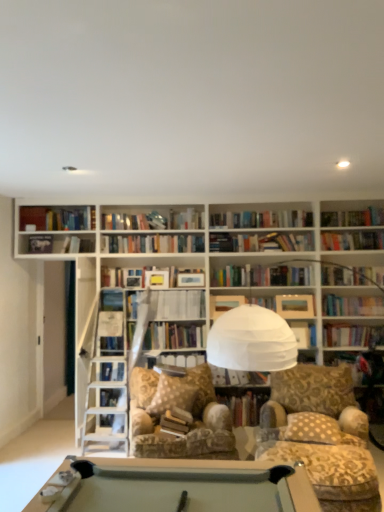
Question: Is hardcover book at upper left, the first paperback book from the left, facing towards patterned fabric chair at center?

Choices:
 (A) no
 (B) yes

Answer: (A)

Question: Is hardcover book at upper left, the first paperback book from the left, in front of patterned fabric chair at center?

Choices:
 (A) no
 (B) yes

Answer: (A)

Question: Is hardcover book at upper left, the first paperback book from the left, shorter than patterned fabric chair at center?

Choices:
 (A) no
 (B) yes

Answer: (B)

Question: Would you consider hardcover book at upper left, the fifth paperback book ordered from the bottom, to be distant from patterned fabric chair at center?

Choices:
 (A) yes
 (B) no

Answer: (A)

Question: From the image's perspective, is hardcover book at upper left, the fifth paperback book ordered from the bottom, below patterned fabric chair at center?

Choices:
 (A) yes
 (B) no

Answer: (B)

Question: Does hardcover book at upper left, positioned as the fifth paperback book in right-to-left order, have a larger size compared to patterned fabric chair at center?

Choices:
 (A) yes
 (B) no

Answer: (B)

Question: Is hardcover book at center, which is the 2th paperback book from right to left, positioned behind hardcover book at center, the 3th book from the left?

Choices:
 (A) yes
 (B) no

Answer: (A)

Question: Does hardcover book at center, arranged as the third paperback book when ordered from the bottom, have a greater height compared to hardcover book at center, which is the 1th book in bottom-to-top order?

Choices:
 (A) yes
 (B) no

Answer: (B)

Question: Can you confirm if hardcover book at center, arranged as the 3th paperback book when viewed from the top, is wider than hardcover book at center, the 3th book from the left?

Choices:
 (A) no
 (B) yes

Answer: (A)

Question: Can you confirm if hardcover book at center, arranged as the third paperback book when ordered from the bottom, is positioned to the right of hardcover book at center, the 3th book from the left?

Choices:
 (A) yes
 (B) no

Answer: (B)

Question: Considering the relative sizes of hardcover book at center, arranged as the third paperback book when ordered from the bottom, and hardcover book at center, which is the 1th book in bottom-to-top order, in the image provided, is hardcover book at center, arranged as the third paperback book when ordered from the bottom, shorter than hardcover book at center, which is the 1th book in bottom-to-top order,?

Choices:
 (A) yes
 (B) no

Answer: (A)

Question: From the image's perspective, would you say hardcover book at upper left, positioned as the fifth paperback book in right-to-left order, is shown under hardcover book at center, which is the 2th paperback book from right to left?

Choices:
 (A) yes
 (B) no

Answer: (B)